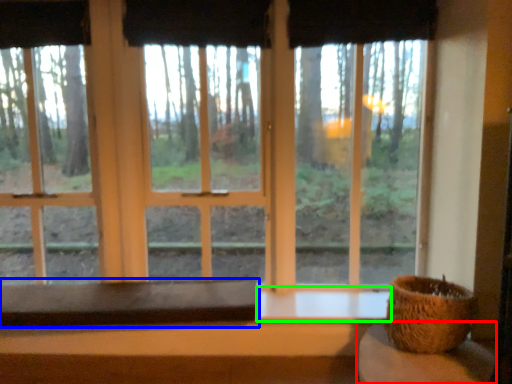
Question: Which object is positioned closest to table (highlighted by a red box)? Select from table (highlighted by a blue box) and window sill (highlighted by a green box).

Choices:
 (A) table
 (B) window sill

Answer: (B)